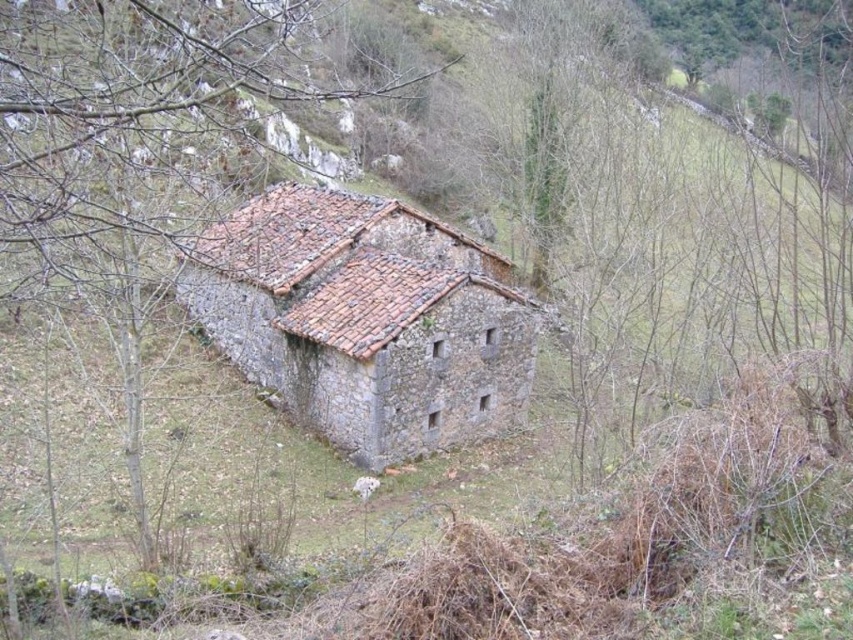
Question: Which point is farther to the camera?

Choices:
 (A) 200,112
 (B) 404,440

Answer: (A)

Question: Does brown bark tree at center appear over rustic stone barn at center?

Choices:
 (A) no
 (B) yes

Answer: (B)

Question: Is brown bark tree at center positioned in front of rustic stone barn at center?

Choices:
 (A) yes
 (B) no

Answer: (A)

Question: Which object appears farthest from the camera in this image?

Choices:
 (A) brown bark tree at center
 (B) rustic stone barn at center

Answer: (B)

Question: In this image, where is brown bark tree at center located relative to rustic stone barn at center?

Choices:
 (A) left
 (B) right

Answer: (A)

Question: Which of the following is the closest to the observer?

Choices:
 (A) (387, 272)
 (B) (200, 140)

Answer: (A)